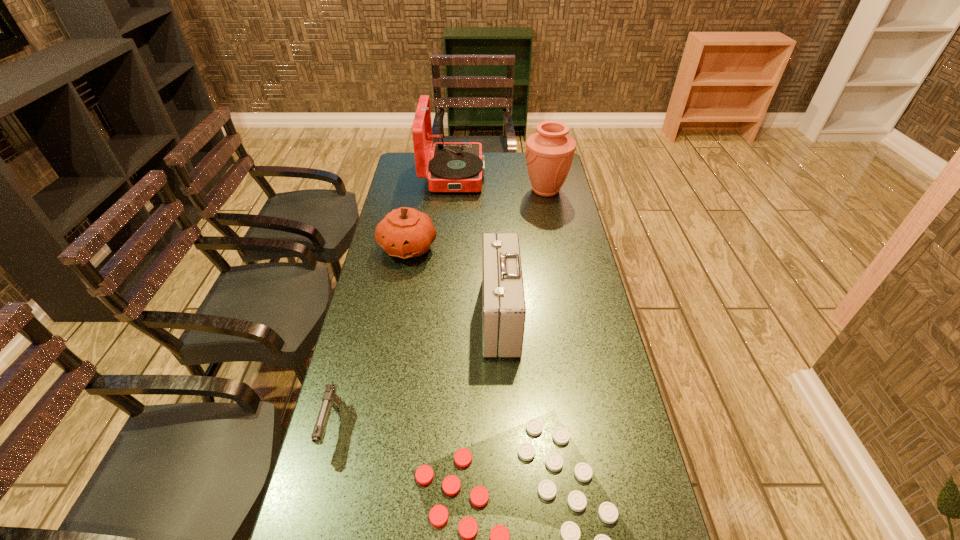
Image resolution: width=960 pixels, height=540 pixels. In order to click on vacant space at the far edge of the desktop in this screenshot , I will do `click(499, 158)`.

At what (x,y) coordinates should I click in order to perform the action: click on free space at the left edge of the desktop. Please return your answer as a coordinate pair (x, y). This screenshot has width=960, height=540. Looking at the image, I should click on (349, 413).

The image size is (960, 540). Identify the location of vacant space at the right edge of the desktop. (591, 302).

This screenshot has width=960, height=540. Find the location of `empty space that is in between the fourth tallest object and the vase`. empty space that is in between the fourth tallest object and the vase is located at coordinates coord(477,219).

I want to click on empty space that is in between the vase and the fourth farthest object, so click(523, 253).

Identify the location of vacant space that's between the vase and the third shortest object. (477, 219).

At what (x,y) coordinates should I click in order to perform the action: click on vacant space that's between the vase and the third shortest object. Please return your answer as a coordinate pair (x, y). Looking at the image, I should click on (477, 219).

Locate an element on the screen. Image resolution: width=960 pixels, height=540 pixels. the fourth closest object relative to the phonograph_record is located at coordinates (330, 399).

The image size is (960, 540). In order to click on the third closest object to the phonograph_record in this screenshot , I will do (x=504, y=311).

At what (x,y) coordinates should I click in order to perform the action: click on vacant area in the image that satisfies the following two spatial constraints: 1. on the front side of the vase; 2. on the front-facing side of the fourth farthest object. Please return your answer as a coordinate pair (x, y). The width and height of the screenshot is (960, 540). Looking at the image, I should click on (571, 316).